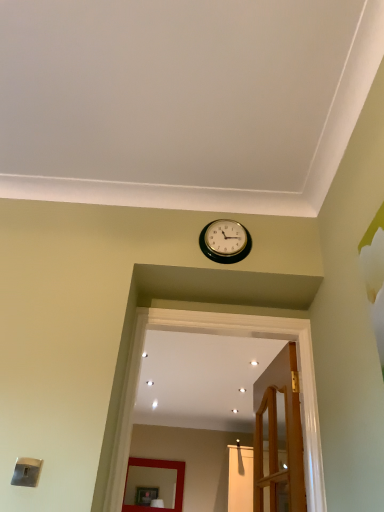
Question: From a real-world perspective, relative to matte red mirror at center, is gold metallic wall clock at upper center vertically above or below?

Choices:
 (A) below
 (B) above

Answer: (B)

Question: Is gold metallic wall clock at upper center spatially inside matte red mirror at center, or outside of it?

Choices:
 (A) inside
 (B) outside

Answer: (B)

Question: Which object is positioned farthest from the wooden door at center?

Choices:
 (A) gold metallic wall clock at upper center
 (B) matte red mirror at center
 (C) transparent glass door at lower center

Answer: (B)

Question: Which object is the farthest from the wooden door at center?

Choices:
 (A) matte red mirror at center
 (B) gold metallic wall clock at upper center
 (C) transparent glass door at lower center

Answer: (A)